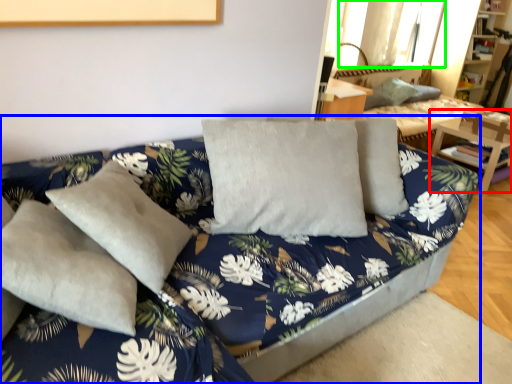
Question: Which object is positioned closest to table (highlighted by a red box)? Select from studio couch (highlighted by a blue box) and window (highlighted by a green box).

Choices:
 (A) studio couch
 (B) window

Answer: (B)